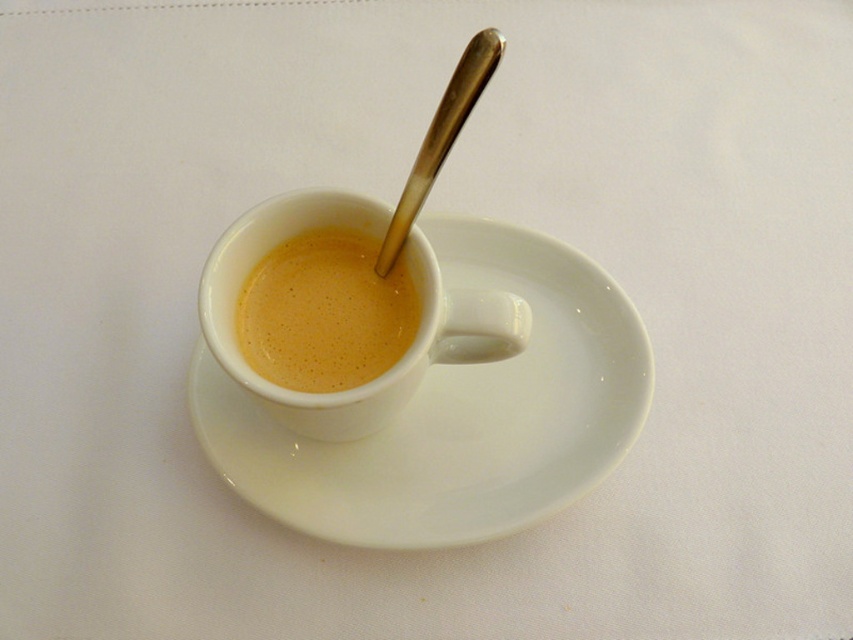
You are observing a cup of coffee with a spoon in it. There are two points marked in the image. Which point is closer to you, point (206, 406) or point (416, 211)?

Point (206, 406) is closer to you because it is further to the viewer than point (416, 211).

You are setting up a table for a tea ceremony and need to place both the smooth cream cup at center and the polished metal spoon at upper center. Given their sizes, which object should you place first to ensure proper arrangement?

The smooth cream cup at center should be placed first because it occupies less space than the polished metal spoon at upper center, allowing you to position the spoon around it without overcrowding the area.

You are a barista arranging items on a counter. You need to place the polished metal spoon at upper center and the smooth cream cup at center so that customers can easily see both items. Based on the current arrangement, is the spoon visible from the front view of the cup?

The polished metal spoon at upper center is behind the smooth cream cup at center, so it might not be fully visible from the front view of the cup. Adjust the spoon position to ensure it is in front of the cup for better visibility.